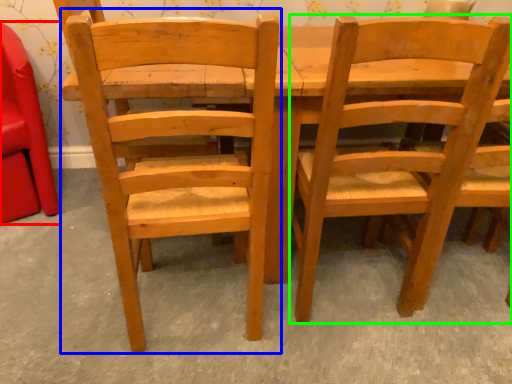
Question: Which is farther away from chair (highlighted by a red box)? chair (highlighted by a blue box) or chair (highlighted by a green box)?

Choices:
 (A) chair
 (B) chair

Answer: (B)